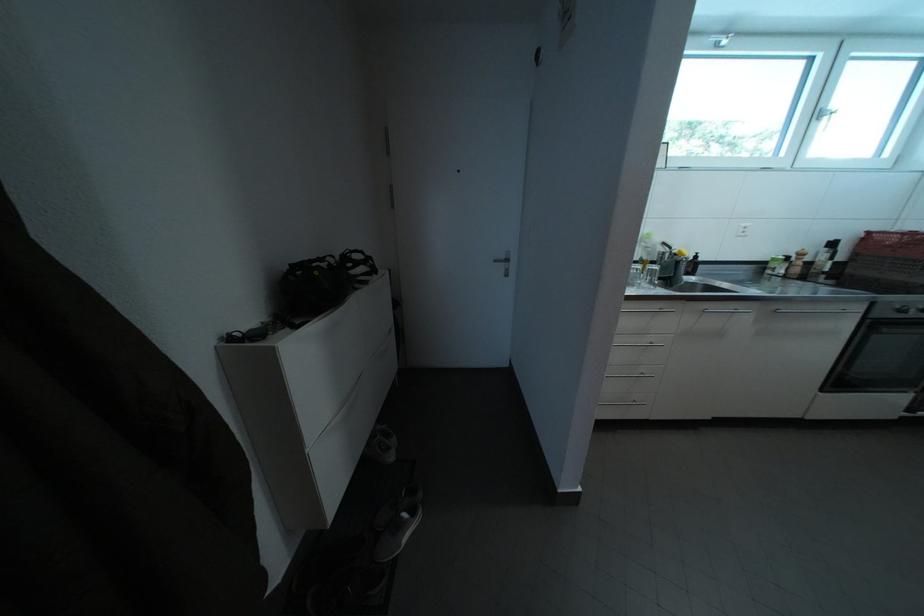
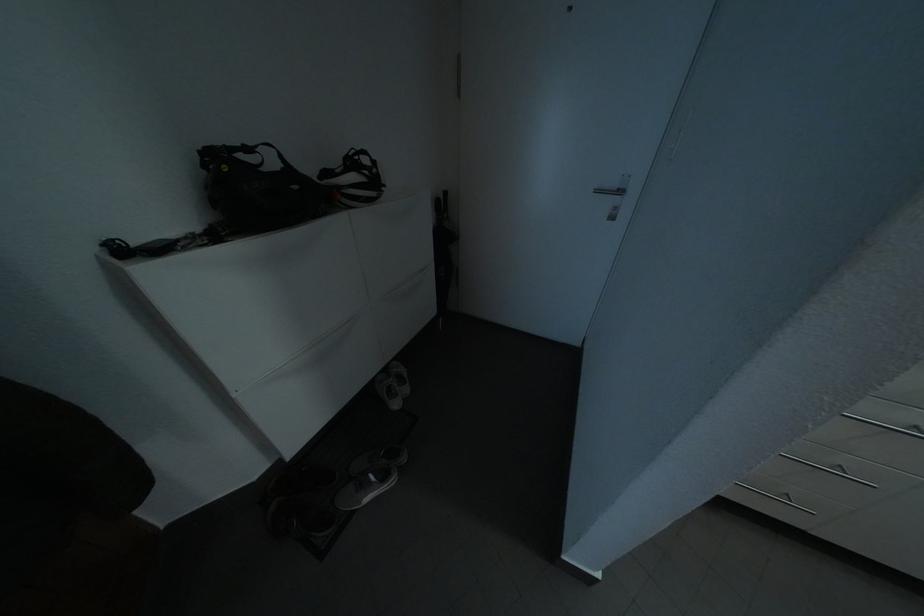
In the second image, find the point that corresponds to (x=513, y=262) in the first image.

(624, 191)